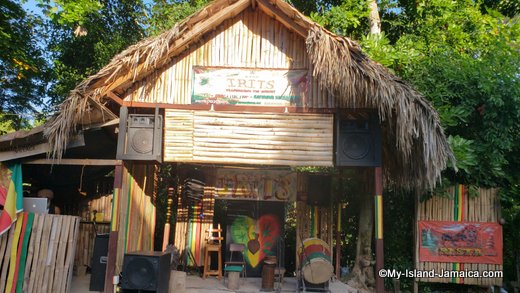
Find the location of a particular element. Image resolution: width=520 pixels, height=293 pixels. red cloth is located at coordinates (462, 231).